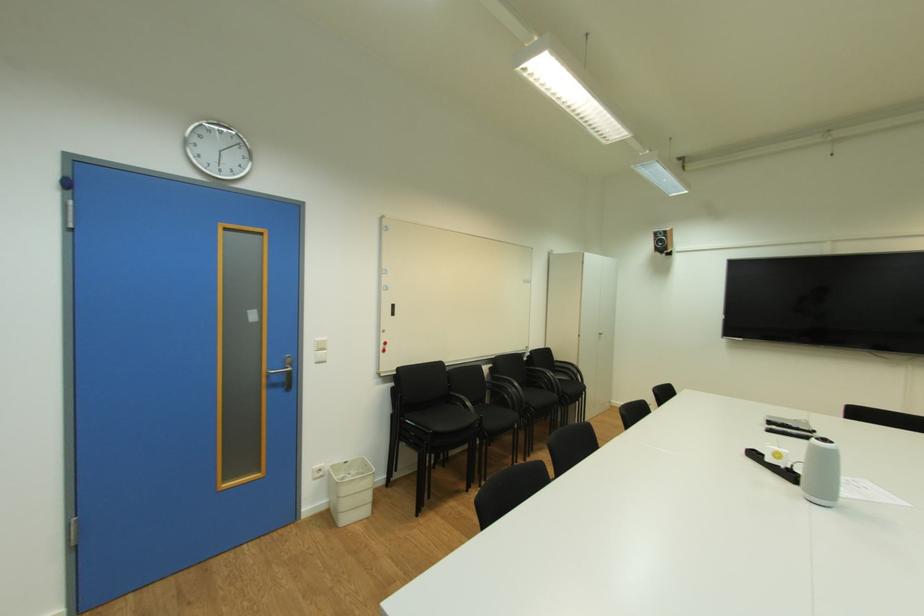
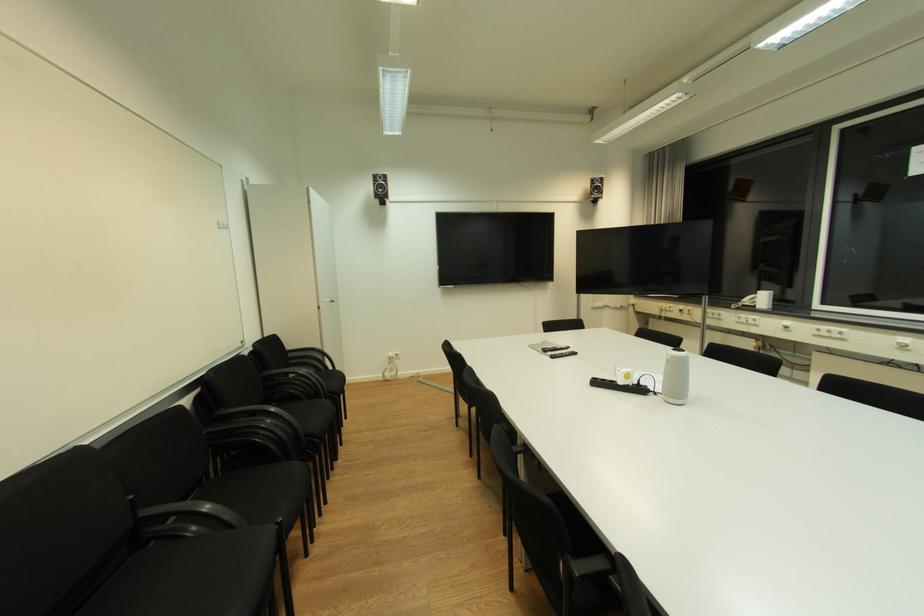
Where in the second image is the point corresponding to pixel 773 461 from the first image?

(626, 384)